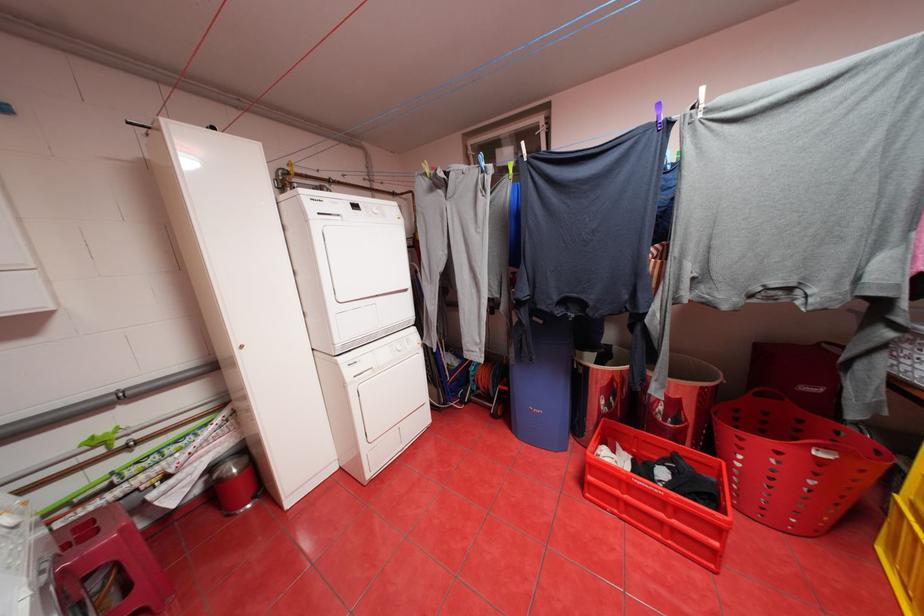
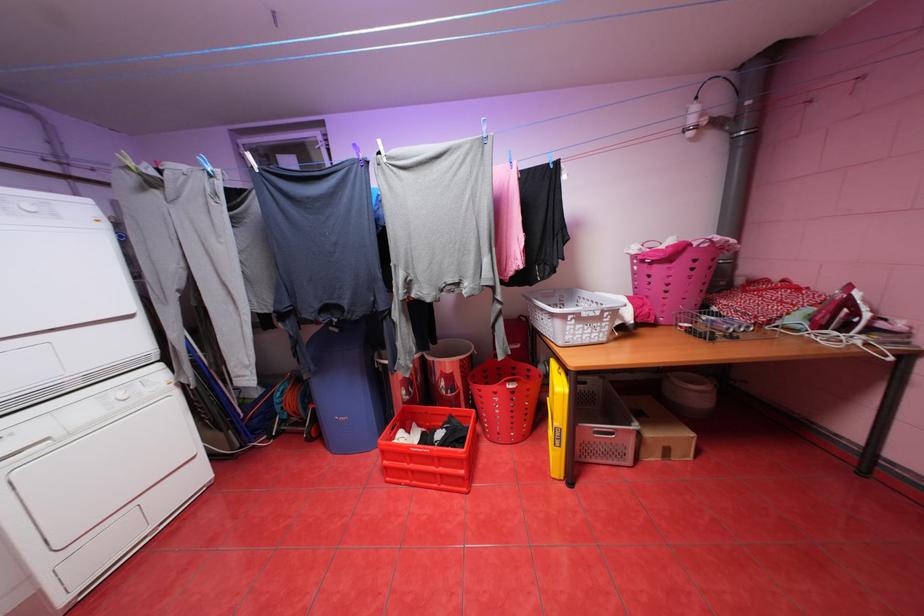
Question: The camera is either moving clockwise (left) or counter-clockwise (right) around the object. The first image is from the beginning of the video and the second image is from the end. Is the camera moving left or right when shooting the video?

Choices:
 (A) Left
 (B) Right

Answer: (A)